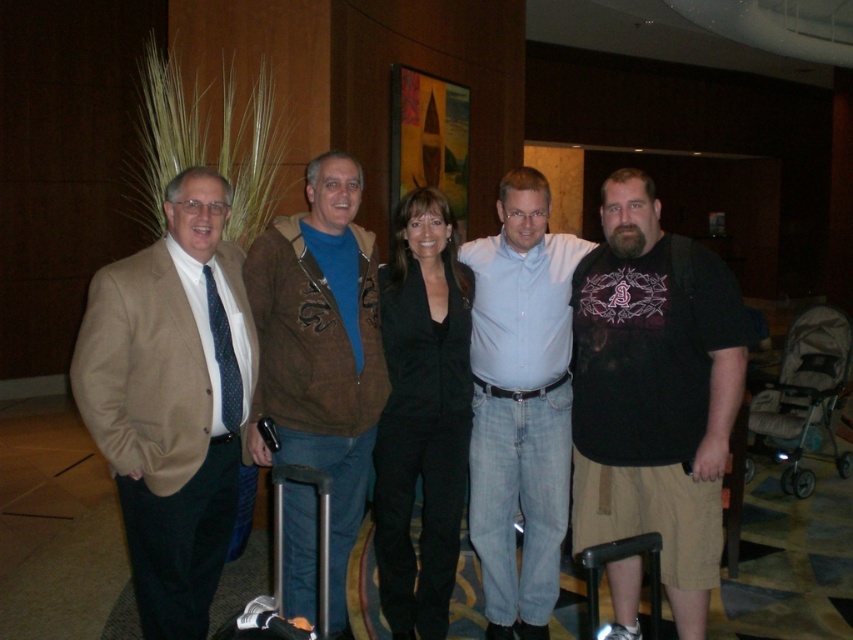
Question: Which of these objects is positioned closest to the light blue button-down shirt at center?

Choices:
 (A) brown leather jacket at center
 (B) black plastic suitcase at lower center
 (C) beige textured blazer at left
 (D) black cotton t-shirt at center

Answer: (D)

Question: Is black cotton t-shirt at center smaller than light blue button-down shirt at center?

Choices:
 (A) yes
 (B) no

Answer: (B)

Question: Which object appears farthest from the camera in this image?

Choices:
 (A) beige textured blazer at left
 (B) light blue button-down shirt at center
 (C) black cotton t-shirt at center

Answer: (B)

Question: Is beige textured blazer at left wider than light blue button-down shirt at center?

Choices:
 (A) yes
 (B) no

Answer: (B)

Question: Among these objects, which one is farthest from the camera?

Choices:
 (A) black cotton t-shirt at center
 (B) black hard suitcase at lower right

Answer: (A)

Question: Does brown leather jacket at center have a greater width compared to black plastic suitcase at lower center?

Choices:
 (A) yes
 (B) no

Answer: (A)